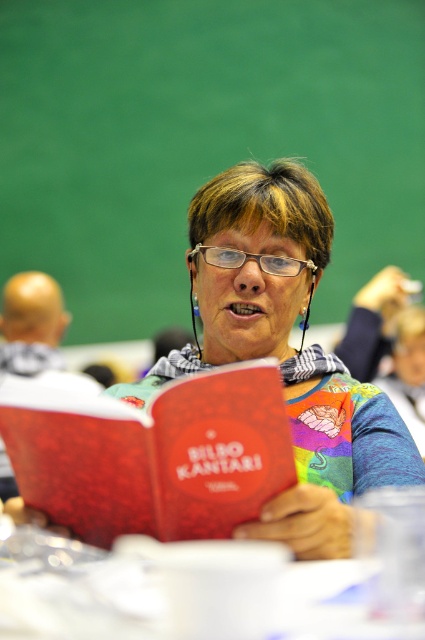
Which is below, matte red book at center or red matte book at center?

Positioned lower is red matte book at center.

Can you confirm if matte red book at center is taller than red matte book at center?

Yes, matte red book at center is taller than red matte book at center.

Who is more forward, (243, 236) or (246, 513)?

Result: Point (246, 513)

Where is `matte red book at center`? The width and height of the screenshot is (425, 640). matte red book at center is located at coordinates (286, 355).

Who is shorter, matte red book at center or transparent plastic glasses at center?

Standing shorter between the two is transparent plastic glasses at center.

The image size is (425, 640). What do you see at coordinates (286, 355) in the screenshot?
I see `matte red book at center` at bounding box center [286, 355].

Where is `matte red book at center`? The image size is (425, 640). matte red book at center is located at coordinates (286, 355).

Can you confirm if red matte book at center is positioned to the right of transparent plastic glasses at center?

Incorrect, red matte book at center is not on the right side of transparent plastic glasses at center.

Is point (195, 422) farther from viewer compared to point (190, 259)?

No.

You are a GUI agent. You are given a task and a screenshot of the screen. Output one action in this format:
    pyautogui.click(x=<x>, y=<y>)
    Task: Click on the red matte book at center
    The height and width of the screenshot is (640, 425).
    Given the screenshot: What is the action you would take?
    pyautogui.click(x=158, y=458)

The width and height of the screenshot is (425, 640). Identify the location of red matte book at center. (158, 458).